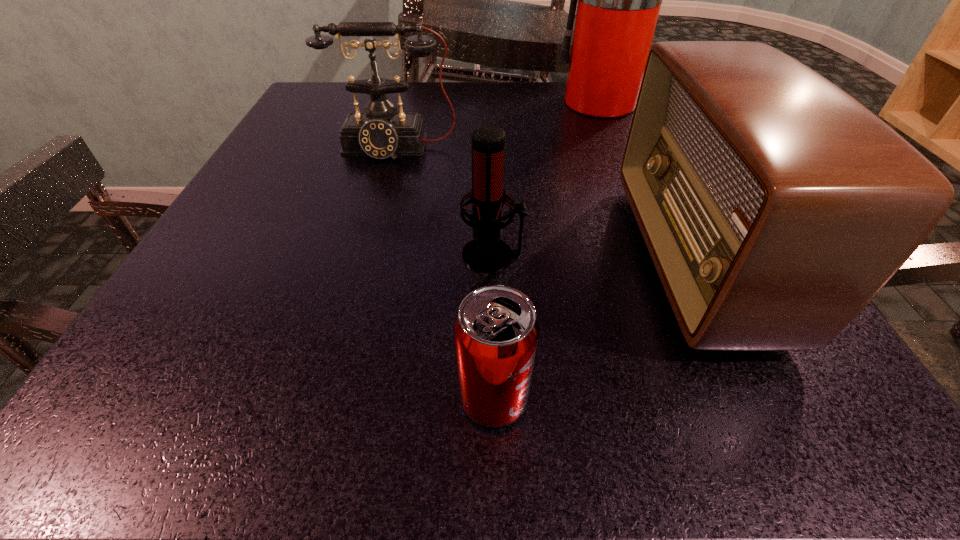
The image size is (960, 540). Identify the location of fire extinguisher that is positioned at the right edge. (619, 0).

The image size is (960, 540). What are the coordinates of `radio receiver present at the right edge` in the screenshot? It's located at (775, 206).

The height and width of the screenshot is (540, 960). What are the coordinates of `object that is at the far right corner` in the screenshot? It's located at (619, 0).

This screenshot has width=960, height=540. I want to click on object that is at the near right corner, so click(775, 206).

This screenshot has height=540, width=960. In the image, there is a desktop. In order to click on vacant space at the far edge in this screenshot , I will do `click(523, 82)`.

Where is `vacant space at the near edge`? The height and width of the screenshot is (540, 960). vacant space at the near edge is located at coordinates (609, 423).

Locate an element on the screen. The height and width of the screenshot is (540, 960). vacant space at the left edge of the desktop is located at coordinates (273, 314).

You are a GUI agent. You are given a task and a screenshot of the screen. Output one action in this format:
    pyautogui.click(x=<x>, y=<y>)
    Task: Click on the free space between the soda can and the radio receiver
    
    Given the screenshot: What is the action you would take?
    pyautogui.click(x=593, y=329)

Identify the location of free spot between the farthest object and the shortest object. The height and width of the screenshot is (540, 960). (547, 251).

Locate an element on the screen. The width and height of the screenshot is (960, 540). free space between the soda can and the radio receiver is located at coordinates (593, 329).